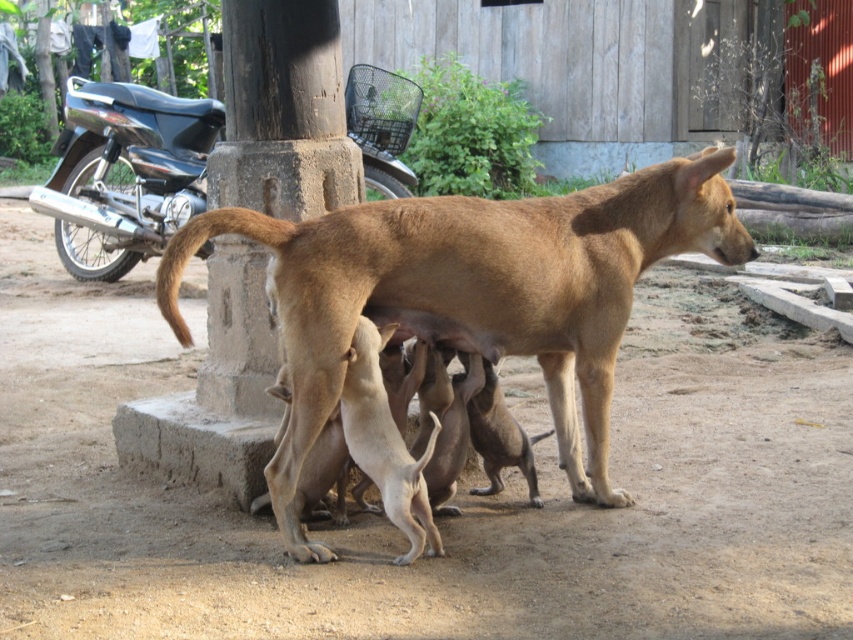
Question: Estimate the real-world distances between objects in this image. Which object is farther from the brown concrete pillar at center?

Choices:
 (A) black glossy motorcycle at upper left
 (B) brown smooth dog at center

Answer: (A)

Question: Based on their relative distances, which object is nearer to the brown concrete pillar at center?

Choices:
 (A) brown smooth dog at center
 (B) black glossy motorcycle at upper left

Answer: (A)

Question: Can you confirm if brown smooth dog at center is smaller than brown concrete pillar at center?

Choices:
 (A) no
 (B) yes

Answer: (A)

Question: Does brown smooth dog at center appear under black glossy motorcycle at upper left?

Choices:
 (A) no
 (B) yes

Answer: (B)

Question: Which object is farther from the camera taking this photo?

Choices:
 (A) brown smooth dog at center
 (B) black glossy motorcycle at upper left
 (C) brown concrete pillar at center

Answer: (B)

Question: Is brown smooth dog at center positioned at the back of black glossy motorcycle at upper left?

Choices:
 (A) yes
 (B) no

Answer: (B)